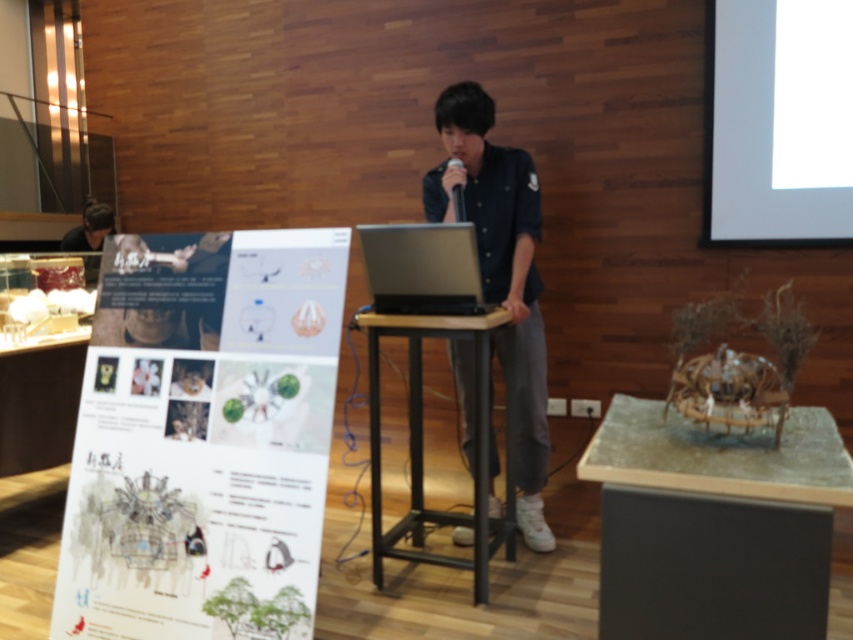
You are sitting in the front row of the conference room and notice two points marked in the scene. The first point is at coordinate point(204, 358) and the second is at point(440, 230). Which of these two points is nearer to you?

Point(204, 358) is closer to the viewer than point(440, 230), so the first point is nearer to you.

You are standing in the conference room and want to determine which of the two points, point (271,248) or point (448,561), is closer to you. Based on the scene, which point is nearer?

Point (271,248) is closer to the camera than point (448,561), so it is the nearer one.

You are an attendee at the presentation. You see the white paper poster at left and the black matte shirt at center. Which object is located to the left of the other?

The white paper poster at left is positioned on the left side of black matte shirt at center.